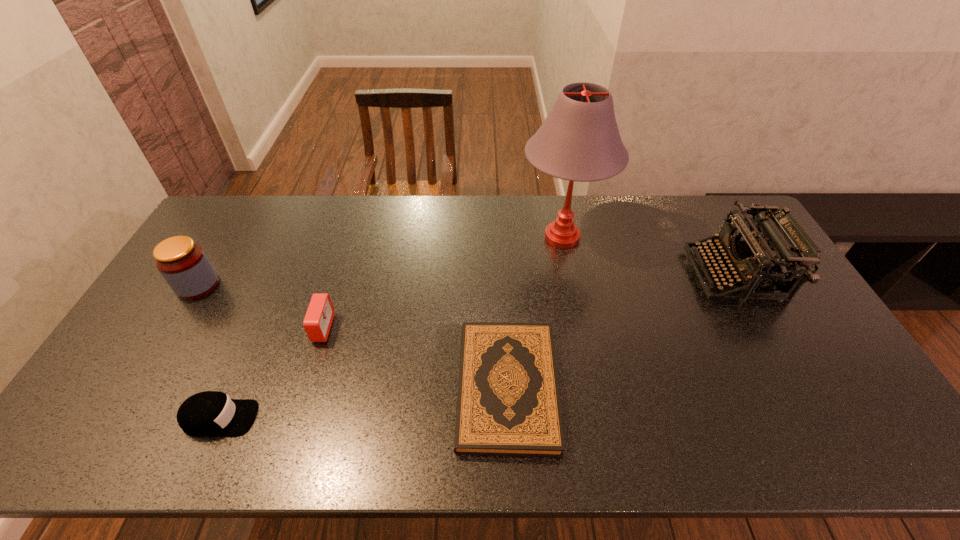
I want to click on table lamp, so click(579, 140).

This screenshot has width=960, height=540. In order to click on the second tallest object in this screenshot , I will do `click(773, 237)`.

Where is `the rightmost object`? The width and height of the screenshot is (960, 540). the rightmost object is located at coordinates (773, 237).

Image resolution: width=960 pixels, height=540 pixels. Find the location of `jar`. jar is located at coordinates (184, 265).

At what (x,y) coordinates should I click in order to perform the action: click on the fourth shortest object. Please return your answer as a coordinate pair (x, y). This screenshot has width=960, height=540. Looking at the image, I should click on (184, 265).

Find the location of a particular element. This screenshot has width=960, height=540. alarm clock is located at coordinates (319, 316).

Where is `the third shortest object`? the third shortest object is located at coordinates (319, 316).

At what (x,y) coordinates should I click in order to perform the action: click on cap. Please return your answer as a coordinate pair (x, y). This screenshot has width=960, height=540. Looking at the image, I should click on (210, 413).

This screenshot has height=540, width=960. I want to click on the second shortest object, so click(x=210, y=413).

I want to click on the shortest object, so click(x=508, y=404).